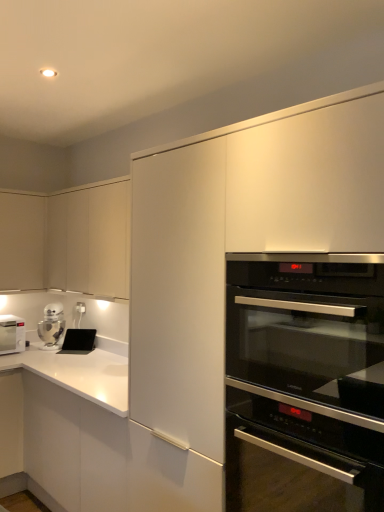
Question: Should I look upward or downward to see black matte tablet at lower left?

Choices:
 (A) down
 (B) up

Answer: (A)

Question: Is the depth of matte white cabinet at upper left, the second cabinetry in the left-to-right sequence, greater than that of white matte microwave at left?

Choices:
 (A) no
 (B) yes

Answer: (A)

Question: Is matte white cabinet at upper left, the second cabinetry in the left-to-right sequence, beside white matte microwave at left?

Choices:
 (A) no
 (B) yes

Answer: (A)

Question: Are matte white cabinet at upper left, the second cabinetry in the left-to-right sequence, and white matte microwave at left far apart?

Choices:
 (A) yes
 (B) no

Answer: (B)

Question: Does matte white cabinet at upper left, the second cabinetry in the left-to-right sequence, have a lesser width compared to white matte microwave at left?

Choices:
 (A) yes
 (B) no

Answer: (A)

Question: Can you confirm if matte white cabinet at upper left, the second cabinetry in the left-to-right sequence, is wider than white matte microwave at left?

Choices:
 (A) yes
 (B) no

Answer: (B)

Question: Does matte white cabinet at upper left, arranged as the 1th cabinetry when viewed from the right, lie in front of white matte microwave at left?

Choices:
 (A) yes
 (B) no

Answer: (A)

Question: Is the surface of black matte tablet at lower left in direct contact with black glass oven at center right?

Choices:
 (A) yes
 (B) no

Answer: (B)

Question: Is black matte tablet at lower left positioned with its back to black glass oven at center right?

Choices:
 (A) no
 (B) yes

Answer: (A)

Question: Considering the relative sizes of black matte tablet at lower left and black glass oven at center right in the image provided, is black matte tablet at lower left shorter than black glass oven at center right?

Choices:
 (A) yes
 (B) no

Answer: (A)

Question: From a real-world perspective, is black matte tablet at lower left on black glass oven at center right?

Choices:
 (A) no
 (B) yes

Answer: (A)

Question: Is black matte tablet at lower left surrounding black glass oven at center right?

Choices:
 (A) yes
 (B) no

Answer: (B)

Question: Does black matte tablet at lower left come in front of black glass oven at center right?

Choices:
 (A) no
 (B) yes

Answer: (A)

Question: Is matte white cabinet at upper left, positioned as the 1th cabinetry in left-to-right order, turned away from black glass oven at center right?

Choices:
 (A) no
 (B) yes

Answer: (A)